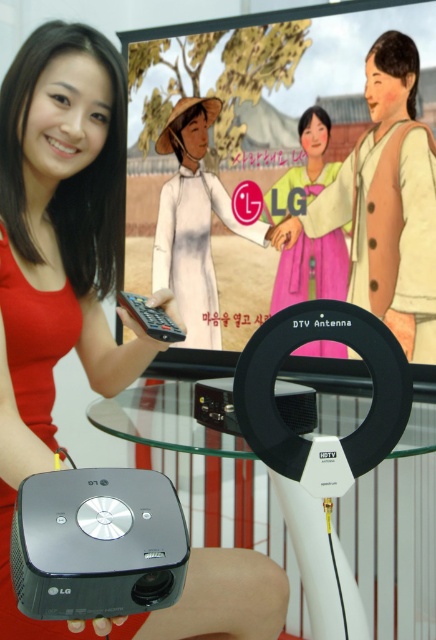
You are a fashion designer observing a runway show. You notice two garments in the scene. The first is a beige fabric vest at upper right and the second is a matte white dress at center. Which garment has a larger size?

The beige fabric vest at upper right is bigger than the matte white dress at center, so the beige fabric vest at upper right has a larger size.